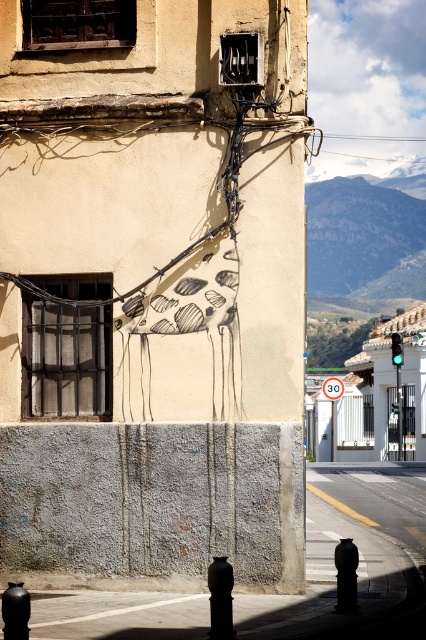
This screenshot has width=426, height=640. I want to click on orange plastic speed limit sign at center, so click(x=333, y=387).

Is orange plastic speed limit sign at center to the left of green glass traffic light at right from the viewer's perspective?

Correct, you'll find orange plastic speed limit sign at center to the left of green glass traffic light at right.

At what (x,y) coordinates should I click in order to perform the action: click on orange plastic speed limit sign at center. Please return your answer as a coordinate pair (x, y). The height and width of the screenshot is (640, 426). Looking at the image, I should click on (333, 387).